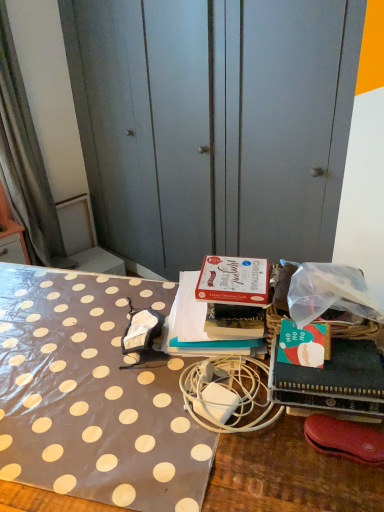
Measure the distance between point (50, 262) and camera.

Point (50, 262) and camera are 8.30 feet apart from each other.

What do you see at coordinates (216, 125) in the screenshot? I see `polka dot fabric at left` at bounding box center [216, 125].

Image resolution: width=384 pixels, height=512 pixels. Identify the location of polka dot fabric at center. (151, 419).

Is the depth of matte cardboard box at center, the 1th book in the back-to-front sequence, greater than that of polka dot fabric at left?

No, matte cardboard box at center, the 1th book in the back-to-front sequence, is closer to the viewer.

Is matte cardboard box at center, placed as the 2th book when sorted from front to back, taller or shorter than polka dot fabric at left?

Clearly, matte cardboard box at center, placed as the 2th book when sorted from front to back, is shorter compared to polka dot fabric at left.

I want to click on the 1st book in front of the polka dot fabric at left, counting from the anchor's position, so click(199, 327).

How many degrees apart are the facing directions of matte cardboard box at center, placed as the 2th book when sorted from front to back, and polka dot fabric at left?

There is a 33.9-degree angle between the facing directions of matte cardboard box at center, placed as the 2th book when sorted from front to back, and polka dot fabric at left.

Which point is more forward, (152, 68) or (368, 434)?

The point (368, 434) is in front.

From the image's perspective, which is below, polka dot fabric at left or leather-like red shoe at lower right?

From the image's view, leather-like red shoe at lower right is below.

Is there a large distance between polka dot fabric at left and leather-like red shoe at lower right?

Absolutely, polka dot fabric at left is distant from leather-like red shoe at lower right.

Is polka dot fabric at left to the left of leather-like red shoe at lower right from the viewer's perspective?

Yes.

Is white matte charger at center facing away from polka dot fabric at left?

Yes, white matte charger at center is facing away from polka dot fabric at left.

Identify the location of twin in front of the polka dot fabric at left. The height and width of the screenshot is (512, 384). (228, 396).

Considering the relative positions of white matte charger at center and polka dot fabric at left in the image provided, is white matte charger at center to the left of polka dot fabric at left from the viewer's perspective?

No, white matte charger at center is not to the left of polka dot fabric at left.

In the scene shown: Between matte cardboard box at center, the 1th book in the back-to-front sequence, and green matte book at right, the 1th book positioned from the front, which one is positioned behind?

matte cardboard box at center, the 1th book in the back-to-front sequence.

From a real-world perspective, who is located higher, matte cardboard box at center, the 1th book in the back-to-front sequence, or green matte book at right, the 1th book positioned from the front?

matte cardboard box at center, the 1th book in the back-to-front sequence.

Is matte cardboard box at center, the 1th book in the back-to-front sequence, completely or partially outside of green matte book at right, arranged as the second book when viewed from the back?

Indeed, matte cardboard box at center, the 1th book in the back-to-front sequence, is completely outside green matte book at right, arranged as the second book when viewed from the back.

Is green matte book at right, arranged as the second book when viewed from the back, shorter than matte cardboard box at center, the 1th book in the back-to-front sequence?

Correct, green matte book at right, arranged as the second book when viewed from the back, is not as tall as matte cardboard box at center, the 1th book in the back-to-front sequence.

The width and height of the screenshot is (384, 512). Find the location of `book in front of the matte cardboard box at center, the 1th book in the back-to-front sequence`. book in front of the matte cardboard box at center, the 1th book in the back-to-front sequence is located at coordinates (332, 381).

Considering the positions of point (244, 352) and point (14, 165), is point (244, 352) closer or farther from the camera than point (14, 165)?

Point (244, 352) is closer to the camera than point (14, 165).

Is matte cardboard box at center, the 1th book in the back-to-front sequence, facing away from gray fabric curtain at left?

matte cardboard box at center, the 1th book in the back-to-front sequence, is not turned away from gray fabric curtain at left.

Consider the image. Does matte cardboard box at center, placed as the 2th book when sorted from front to back, have a lesser width compared to gray fabric curtain at left?

In fact, matte cardboard box at center, placed as the 2th book when sorted from front to back, might be wider than gray fabric curtain at left.

Which is correct: matte cardboard box at center, the 1th book in the back-to-front sequence, is inside gray fabric curtain at left, or outside of it?

matte cardboard box at center, the 1th book in the back-to-front sequence, lies outside gray fabric curtain at left.

Considering the relative sizes of green matte book at right, arranged as the second book when viewed from the back, and white matte charger at center in the image provided, is green matte book at right, arranged as the second book when viewed from the back, shorter than white matte charger at center?

No.

Which object is thinner, green matte book at right, arranged as the second book when viewed from the back, or white matte charger at center?

Thinner between the two is green matte book at right, arranged as the second book when viewed from the back.

Locate an element on the screen. Image resolution: width=384 pixels, height=512 pixels. twin that appears below the green matte book at right, arranged as the second book when viewed from the back (from the image's perspective) is located at coordinates (228, 396).

From the image's perspective, does green matte book at right, arranged as the second book when viewed from the back, appear lower than white matte charger at center?

Incorrect, from the image's perspective, green matte book at right, arranged as the second book when viewed from the back, is higher than white matte charger at center.

Which book is the 1st one when counting from the front of the polka dot fabric at left? Please provide its 2D coordinates.

[(199, 327)]

Identify the location of dresser that appears above the leather-like red shoe at lower right (from the image's perspective). This screenshot has height=512, width=384. click(216, 125).

Which object lies further to the anchor point polka dot fabric at left, leather-like red shoe at lower right or polka dot fabric at center?

leather-like red shoe at lower right.

When comparing their distances from green matte book at right, arranged as the second book when viewed from the back, does leather-like red shoe at lower right or matte cardboard box at center, the 1th book in the back-to-front sequence, seem further?

The object further to green matte book at right, arranged as the second book when viewed from the back, is matte cardboard box at center, the 1th book in the back-to-front sequence.

From the image, which object appears to be nearer to green matte book at right, arranged as the second book when viewed from the back, matte cardboard box at center, placed as the 2th book when sorted from front to back, or polka dot fabric at center?

matte cardboard box at center, placed as the 2th book when sorted from front to back, is closer to green matte book at right, arranged as the second book when viewed from the back.

Estimate the real-world distances between objects in this image. Which object is closer to polka dot fabric at center, polka dot fabric at left or green matte book at right, the 1th book positioned from the front?

Among the two, green matte book at right, the 1th book positioned from the front, is located nearer to polka dot fabric at center.

Which object lies further to the anchor point gray fabric curtain at left, matte cardboard box at center, placed as the 2th book when sorted from front to back, or green matte book at right, arranged as the second book when viewed from the back?

green matte book at right, arranged as the second book when viewed from the back, is positioned further to the anchor gray fabric curtain at left.

Which object lies further to the anchor point polka dot fabric at left, white matte charger at center or matte cardboard box at center, placed as the 2th book when sorted from front to back?

The object further to polka dot fabric at left is white matte charger at center.

Estimate the real-world distances between objects in this image. Which object is further from polka dot fabric at left, polka dot fabric at center or gray fabric curtain at left?

polka dot fabric at center is positioned further to the anchor polka dot fabric at left.

Looking at the image, which one is located closer to polka dot fabric at left, polka dot fabric at center or green matte book at right, the 1th book positioned from the front?

polka dot fabric at center is positioned closer to the anchor polka dot fabric at left.

Identify the location of dresser between gray fabric curtain at left and polka dot fabric at center vertically. (216, 125).

Locate an element on the screen. dresser situated between gray fabric curtain at left and matte cardboard box at center, placed as the 2th book when sorted from front to back, from left to right is located at coordinates [x=216, y=125].

The width and height of the screenshot is (384, 512). Identify the location of twin located between polka dot fabric at center and leather-like red shoe at lower right in the left-right direction. (228, 396).

I want to click on twin between polka dot fabric at left and polka dot fabric at center in the vertical direction, so click(x=228, y=396).